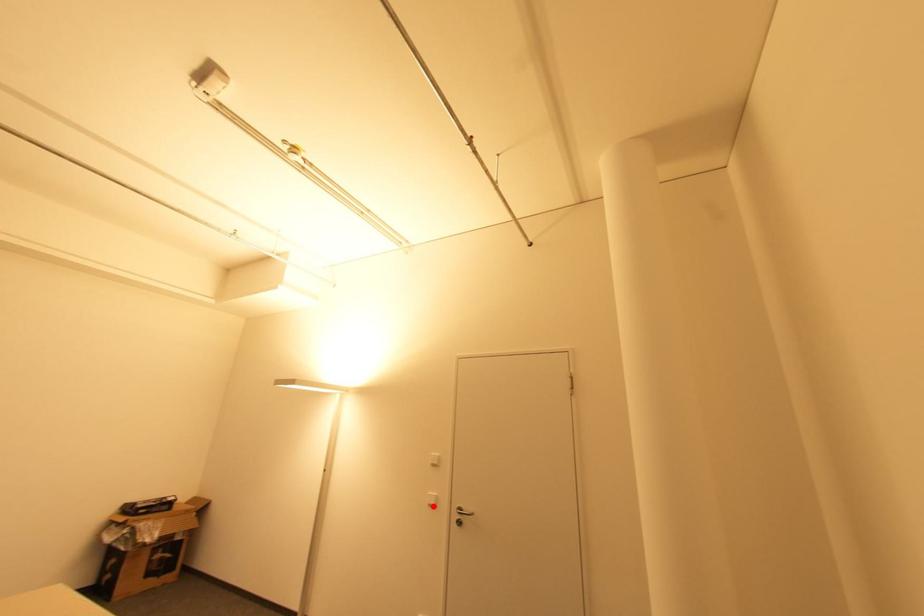
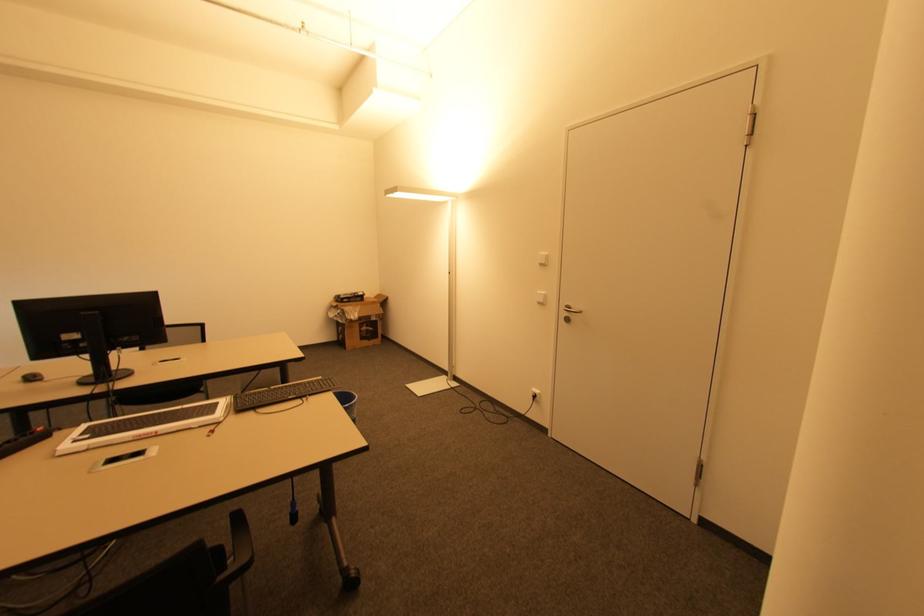
Question: I am providing you with two images of the same scene from different viewpoints. Image1 has a red point marked. In image2, the corresponding 3D location appears at what relative position? Reply with the corresponding letter.

Choices:
 (A) Closer
 (B) Farther

Answer: (A)